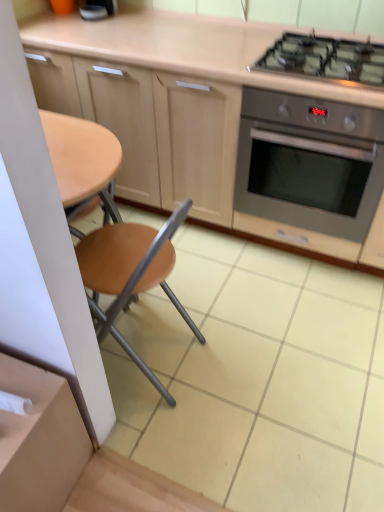
Question: Is stainless steel oven at right oriented towards black glass gas stove at upper right?

Choices:
 (A) no
 (B) yes

Answer: (A)

Question: Is stainless steel oven at right in front of black glass gas stove at upper right?

Choices:
 (A) no
 (B) yes

Answer: (A)

Question: Considering the relative sizes of stainless steel oven at right and black glass gas stove at upper right in the image provided, is stainless steel oven at right shorter than black glass gas stove at upper right?

Choices:
 (A) no
 (B) yes

Answer: (A)

Question: Could black glass gas stove at upper right be considered to be inside stainless steel oven at right?

Choices:
 (A) no
 (B) yes

Answer: (A)

Question: Would you consider stainless steel oven at right to be distant from black glass gas stove at upper right?

Choices:
 (A) no
 (B) yes

Answer: (A)

Question: Can you confirm if stainless steel oven at right is bigger than black glass gas stove at upper right?

Choices:
 (A) no
 (B) yes

Answer: (B)

Question: Can you see black glass gas stove at upper right touching stainless steel oven at right?

Choices:
 (A) yes
 (B) no

Answer: (B)

Question: Is black glass gas stove at upper right not near stainless steel oven at right?

Choices:
 (A) no
 (B) yes

Answer: (A)

Question: From the image's perspective, is black glass gas stove at upper right located beneath stainless steel oven at right?

Choices:
 (A) no
 (B) yes

Answer: (A)

Question: Is black glass gas stove at upper right outside stainless steel oven at right?

Choices:
 (A) yes
 (B) no

Answer: (A)

Question: Is black glass gas stove at upper right facing away from stainless steel oven at right?

Choices:
 (A) yes
 (B) no

Answer: (B)

Question: Can you confirm if black glass gas stove at upper right is bigger than stainless steel oven at right?

Choices:
 (A) yes
 (B) no

Answer: (B)

Question: From a real-world perspective, is matte wood cabinetry at upper center located higher than black glass gas stove at upper right?

Choices:
 (A) yes
 (B) no

Answer: (B)